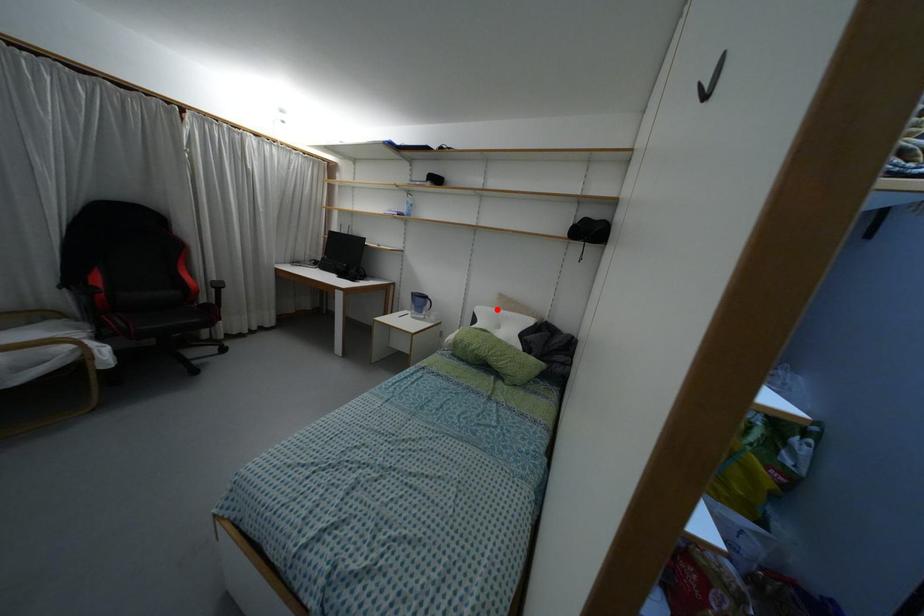
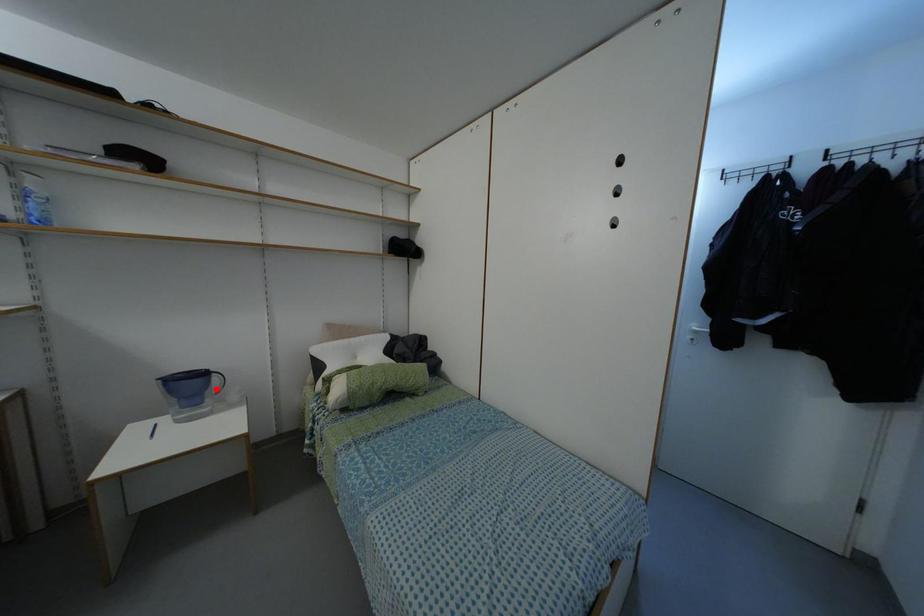
Based on the photo, I am providing you with two images of the same scene from different viewpoints. A red point is marked on the first image and another point is marked on the second image. Is the marked point in image1 the same physical position as the marked point in image2?

No